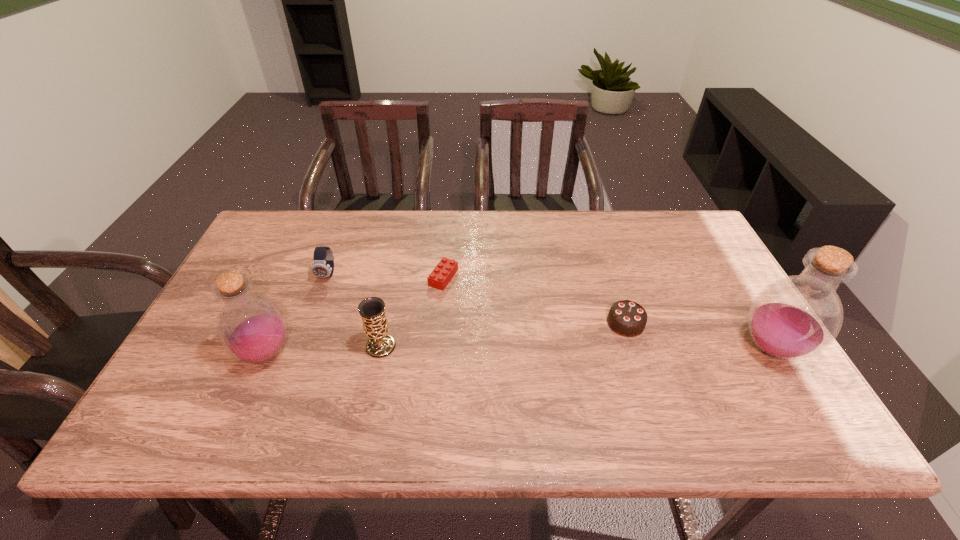
Locate an element on the screen. The height and width of the screenshot is (540, 960). the third tallest object is located at coordinates (372, 310).

Image resolution: width=960 pixels, height=540 pixels. I want to click on vacant space situated on the right of the second tallest object, so click(427, 354).

Find the location of a particular element. vacant space situated 0.060m on the front of the rightmost object is located at coordinates (804, 401).

You are a GUI agent. You are given a task and a screenshot of the screen. Output one action in this format:
    pyautogui.click(x=<x>, y=<y>)
    Task: Click on the free space located 0.160m on the back of the shortest object
    This screenshot has width=960, height=540.
    Given the screenshot: What is the action you would take?
    pyautogui.click(x=447, y=233)

Find the location of a particular element. Image resolution: width=960 pixels, height=540 pixels. free spot located on the face of the fourth tallest object is located at coordinates (306, 333).

At what (x,y) coordinates should I click in order to perform the action: click on vacant space located 0.070m on the front of the chocolate cake. Please return your answer as a coordinate pair (x, y). Looking at the image, I should click on (637, 360).

Identify the location of vacant space located on the back of the third tallest object. (389, 309).

Identify the location of object that is at the left edge. The image size is (960, 540). (252, 328).

Image resolution: width=960 pixels, height=540 pixels. Identify the location of object that is at the right edge. (796, 317).

Image resolution: width=960 pixels, height=540 pixels. In order to click on object that is at the near left corner in this screenshot , I will do `click(252, 328)`.